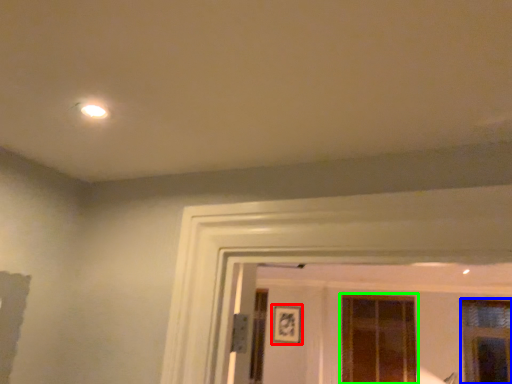
Question: Considering the real-world distances, which object is closest to picture frame (highlighted by a red box)? window (highlighted by a blue box) or window (highlighted by a green box).

Choices:
 (A) window
 (B) window

Answer: (B)